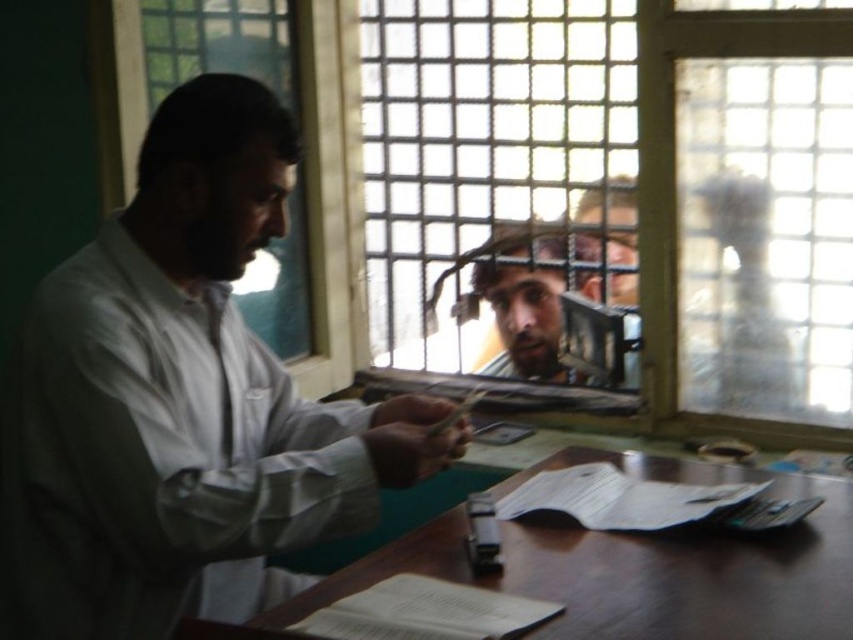
Can you confirm if clear glass window at center is shorter than white matte shirt at center?

No, clear glass window at center is not shorter than white matte shirt at center.

Between clear glass window at center and white matte shirt at center, which one is positioned higher?

clear glass window at center is above.

The height and width of the screenshot is (640, 853). What do you see at coordinates (625, 189) in the screenshot? I see `clear glass window at center` at bounding box center [625, 189].

Where is `clear glass window at center`? The image size is (853, 640). clear glass window at center is located at coordinates (625, 189).

Identify the location of clear glass window at center. This screenshot has width=853, height=640. [625, 189].

Where is `clear glass window at center`? clear glass window at center is located at coordinates (625, 189).

Describe the element at coordinates (180, 403) in the screenshot. I see `white matte shirt at center` at that location.

From the picture: Who is shorter, white matte shirt at center or wooden table at center?

wooden table at center

Describe the element at coordinates (180, 403) in the screenshot. The width and height of the screenshot is (853, 640). I see `white matte shirt at center` at that location.

Locate an element on the screen. This screenshot has height=640, width=853. white matte shirt at center is located at coordinates (180, 403).